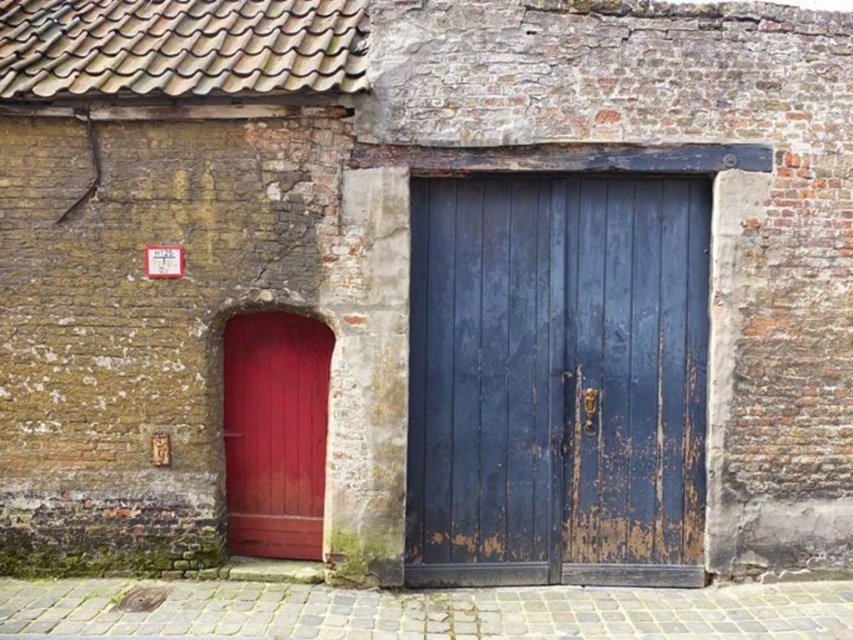
Question: Considering the relative positions of rusty wood door at center and smooth glossy red door at left in the image provided, where is rusty wood door at center located with respect to smooth glossy red door at left?

Choices:
 (A) above
 (B) below

Answer: (A)

Question: Which object appears closest to the camera in this image?

Choices:
 (A) rusty wood door at center
 (B) smooth glossy red door at left

Answer: (A)

Question: From the image, what is the correct spatial relationship of rusty wood door at center in relation to smooth glossy red door at left?

Choices:
 (A) below
 (B) above

Answer: (B)

Question: Which point appears closest to the camera in this image?

Choices:
 (A) (294, 353)
 (B) (675, 468)

Answer: (B)

Question: Among these objects, which one is farthest from the camera?

Choices:
 (A) rusty wood door at center
 (B) smooth glossy red door at left

Answer: (B)

Question: Can you confirm if rusty wood door at center is wider than smooth glossy red door at left?

Choices:
 (A) yes
 (B) no

Answer: (A)